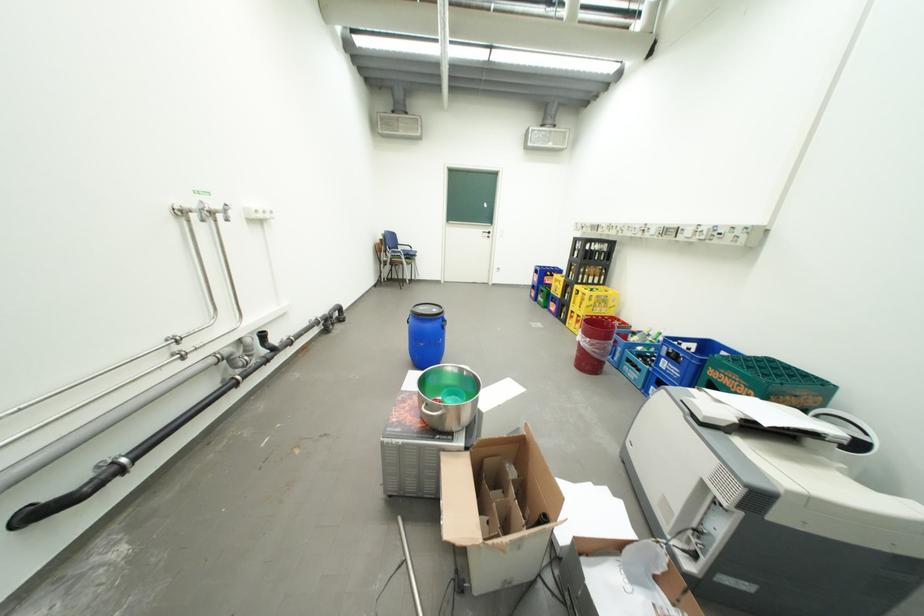
Identify the location of yellow bottle crate. (590, 304).